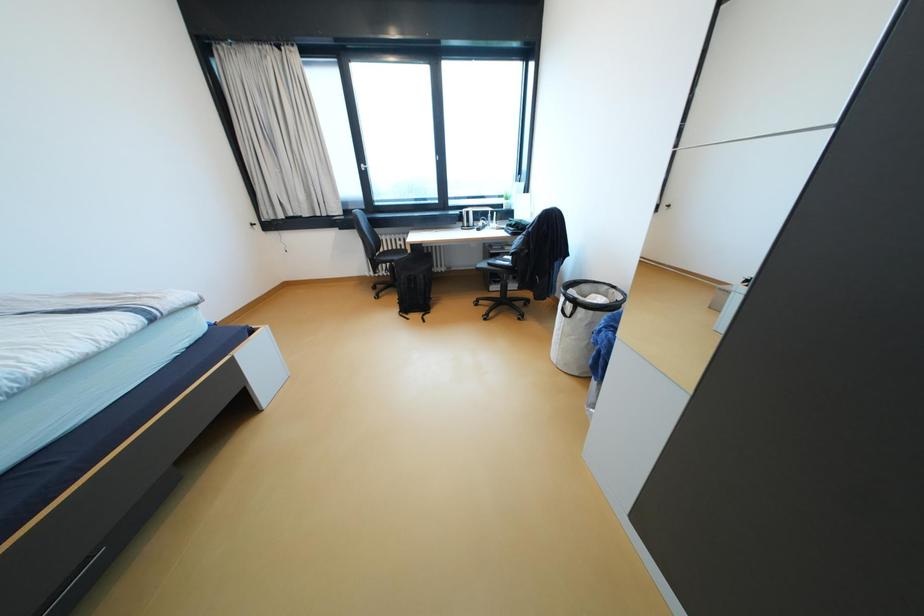
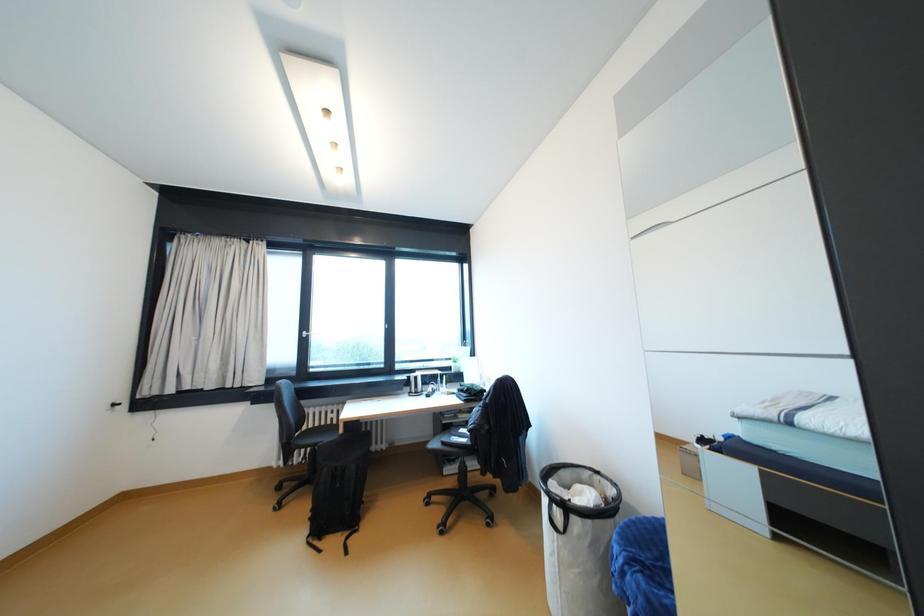
Question: How did the camera likely rotate?

Choices:
 (A) Left
 (B) Right
 (C) Up
 (D) Down

Answer: (C)